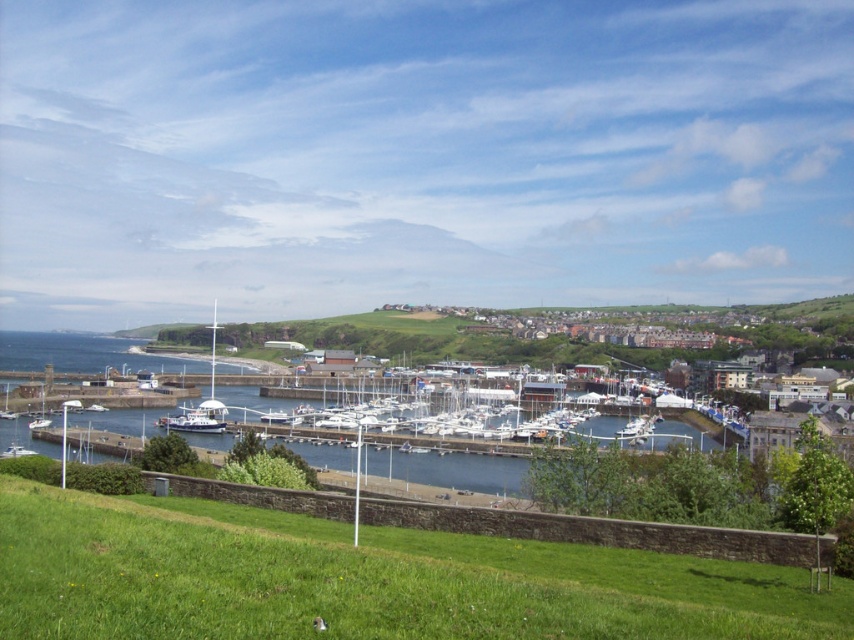
Based on the photo, you are a photographer standing on the grassy slope and want to capture a photo of the white glossy boat at center without the green grass at lower left blocking the view. Based on their heights, is this possible?

The green grass at lower left is taller than the white glossy boat at center, so it will block the view. Move to a higher position to avoid obstruction.

You are standing on the grassy slope overlooking the harbor and see both the white glossy sailboat at lower left and the white glossy boat at lower left. Which one is positioned lower in the scene?

The white glossy sailboat at lower left is positioned lower than the white glossy boat at lower left.

You are standing on the grassy slope and want to walk to the boat. Based on the scene, which object, the green grass at lower left or the white glossy boat at center, is wider?

The green grass at lower left is wider than the white glossy boat at center.